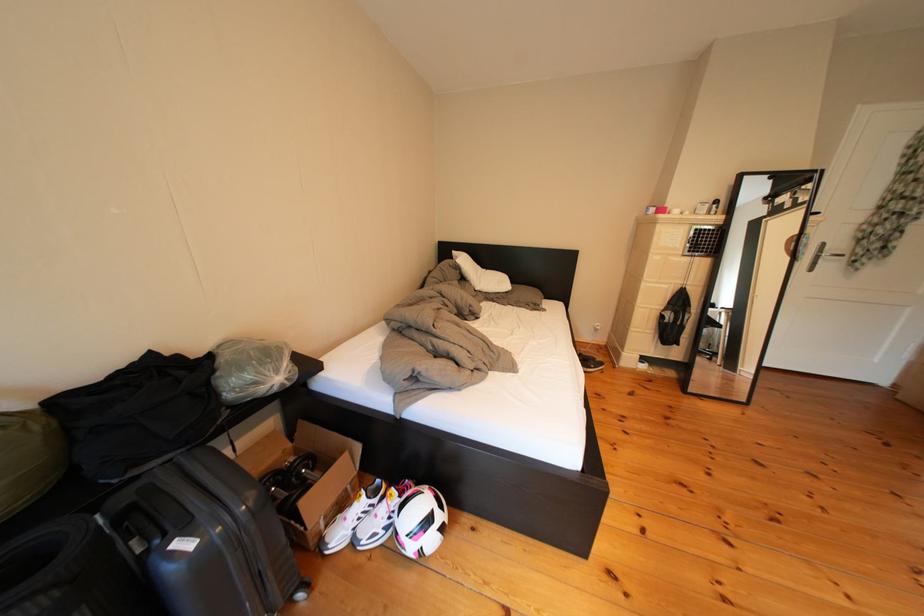
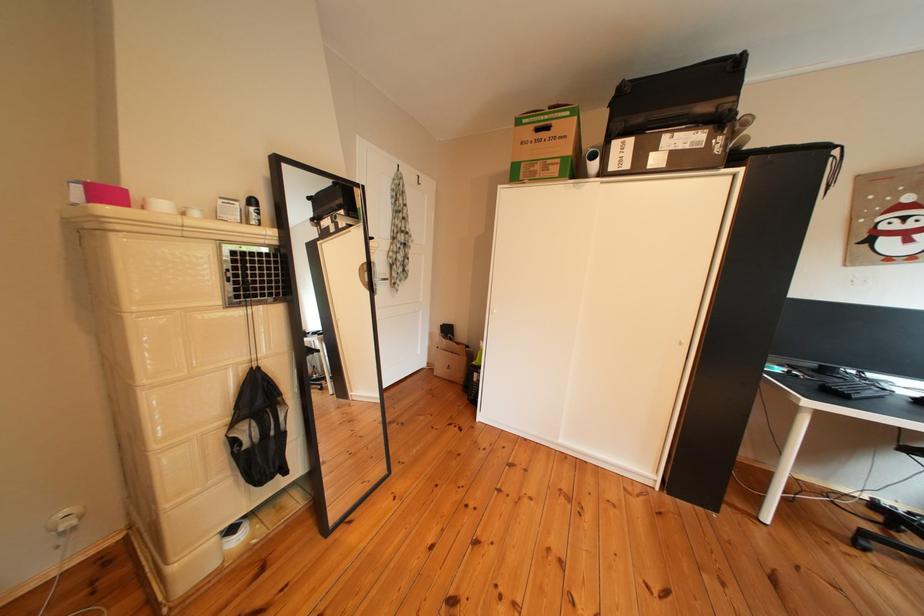
Where in the second image is the point corresponding to [675,215] from the first image?

(123, 199)